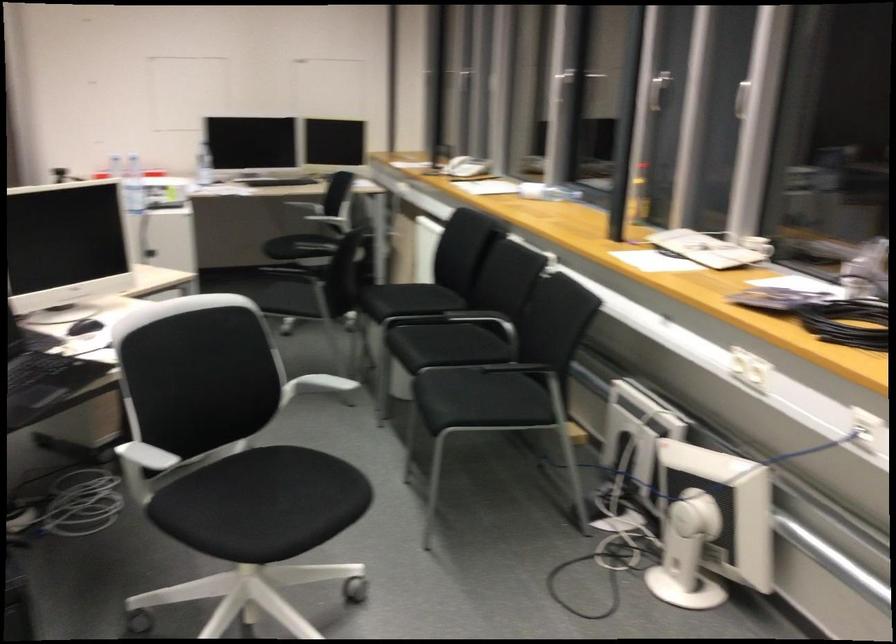
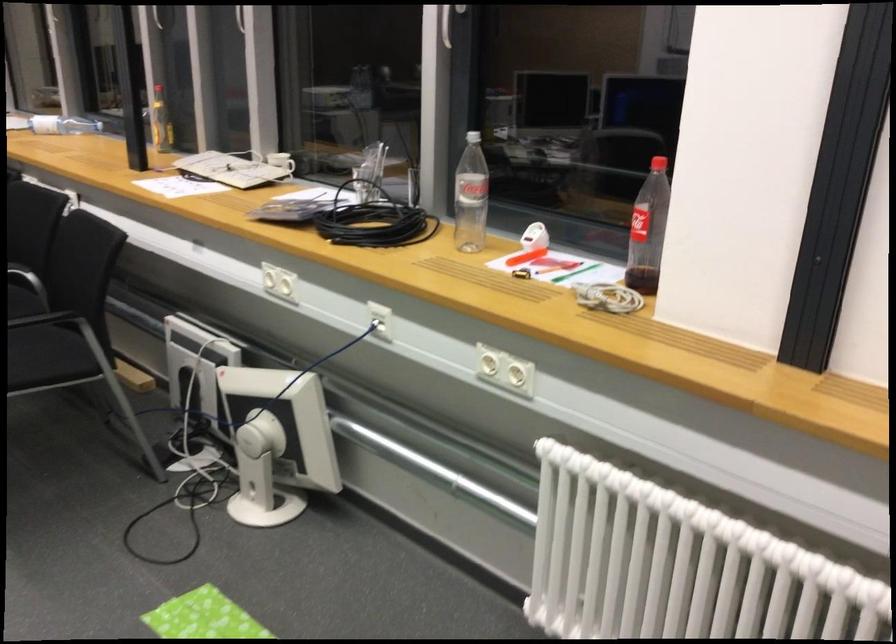
Locate, in the second image, the point that corresponds to point (757, 236) in the first image.

(280, 162)